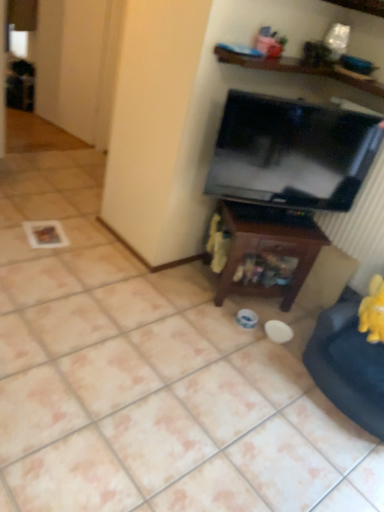
Question: Is velvet yellow swivel chair at lower right bigger or smaller than black glossy tv at upper right?

Choices:
 (A) big
 (B) small

Answer: (A)

Question: Is velvet yellow swivel chair at lower right in front of or behind black glossy tv at upper right in the image?

Choices:
 (A) front
 (B) behind

Answer: (A)

Question: Considering the real-world distances, which object is closest to the velvet yellow swivel chair at lower right?

Choices:
 (A) wooden at upper center
 (B) brown wood table at center
 (C) black glossy tv at upper right

Answer: (B)

Question: Which of these objects is positioned closest to the velvet yellow swivel chair at lower right?

Choices:
 (A) wooden at upper center
 (B) black glossy tv at upper right
 (C) brown wood table at center

Answer: (C)